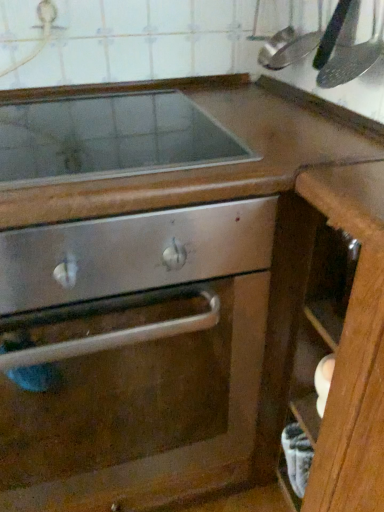
Question: Considering the relative sizes of metallic silver spatula at upper right and stainless steel oven door at center in the image provided, is metallic silver spatula at upper right wider than stainless steel oven door at center?

Choices:
 (A) no
 (B) yes

Answer: (A)

Question: Is metallic silver spatula at upper right to the right of stainless steel oven door at center from the viewer's perspective?

Choices:
 (A) no
 (B) yes

Answer: (B)

Question: Would you say metallic silver spatula at upper right is a long distance from stainless steel oven door at center?

Choices:
 (A) yes
 (B) no

Answer: (B)

Question: Does metallic silver spatula at upper right lie behind stainless steel oven door at center?

Choices:
 (A) no
 (B) yes

Answer: (B)

Question: Can you confirm if metallic silver spatula at upper right is bigger than stainless steel oven door at center?

Choices:
 (A) yes
 (B) no

Answer: (B)

Question: Visually, is metallic silver spatula at upper right positioned to the left or to the right of smooth stainless steel cooktop at upper center?

Choices:
 (A) left
 (B) right

Answer: (B)

Question: Looking at the image, does metallic silver spatula at upper right seem bigger or smaller compared to smooth stainless steel cooktop at upper center?

Choices:
 (A) big
 (B) small

Answer: (B)

Question: Is metallic silver spatula at upper right in front of or behind smooth stainless steel cooktop at upper center in the image?

Choices:
 (A) front
 (B) behind

Answer: (A)

Question: From a real-world perspective, is metallic silver spatula at upper right physically located above or below smooth stainless steel cooktop at upper center?

Choices:
 (A) below
 (B) above

Answer: (B)

Question: Considering the positions of brushed metal faucet at upper left and stainless steel oven door at center in the image, is brushed metal faucet at upper left wider or thinner than stainless steel oven door at center?

Choices:
 (A) wide
 (B) thin

Answer: (B)

Question: From the image's perspective, is brushed metal faucet at upper left above or below stainless steel oven door at center?

Choices:
 (A) above
 (B) below

Answer: (A)

Question: Based on their positions, is brushed metal faucet at upper left located to the left or right of stainless steel oven door at center?

Choices:
 (A) right
 (B) left

Answer: (B)

Question: From a real-world perspective, is brushed metal faucet at upper left above or below stainless steel oven door at center?

Choices:
 (A) below
 (B) above

Answer: (B)

Question: Do you think smooth stainless steel cooktop at upper center is within stainless steel oven door at center, or outside of it?

Choices:
 (A) outside
 (B) inside

Answer: (A)

Question: Considering the positions of smooth stainless steel cooktop at upper center and stainless steel oven door at center in the image, is smooth stainless steel cooktop at upper center taller or shorter than stainless steel oven door at center?

Choices:
 (A) short
 (B) tall

Answer: (A)